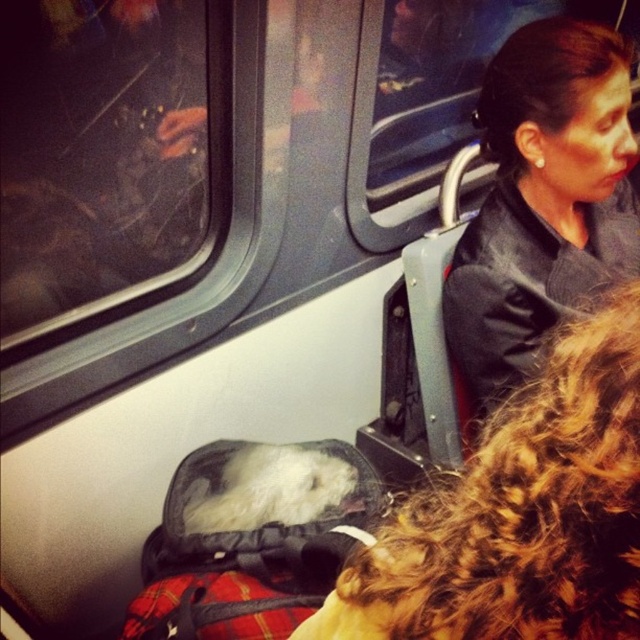
Question: Is smooth black jacket at upper right to the right of black leather jacket at upper right from the viewer's perspective?

Choices:
 (A) no
 (B) yes

Answer: (A)

Question: Considering the relative positions of smooth black jacket at upper right and black leather jacket at upper right in the image provided, where is smooth black jacket at upper right located with respect to black leather jacket at upper right?

Choices:
 (A) right
 (B) left

Answer: (B)

Question: Which object is farther from the camera taking this photo?

Choices:
 (A) black leather jacket at upper right
 (B) smooth black jacket at upper right

Answer: (A)

Question: Which of the following is the farthest from the observer?

Choices:
 (A) (502, 531)
 (B) (628, 70)

Answer: (B)

Question: Is smooth black jacket at upper right further to the viewer compared to black leather jacket at upper right?

Choices:
 (A) no
 (B) yes

Answer: (A)